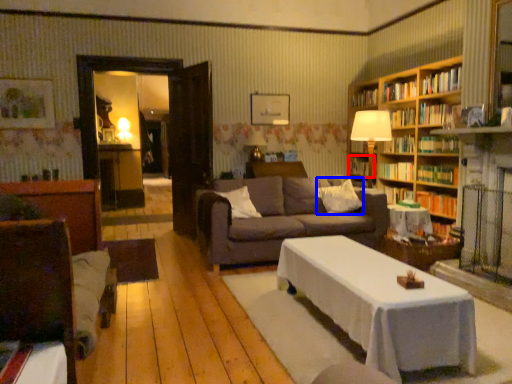
Question: Which point is further to the camera, book (highlighted by a red box) or pillow (highlighted by a blue box)?

Choices:
 (A) book
 (B) pillow

Answer: (A)